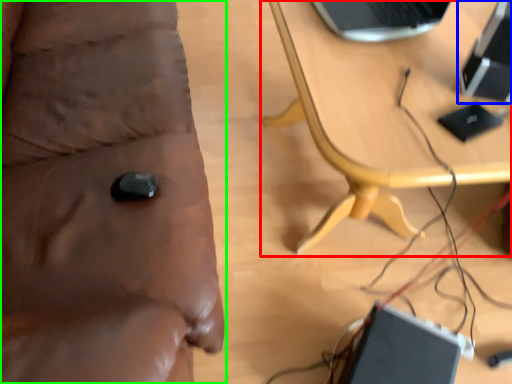
Question: Considering the real-world distances, which object is closest to table (highlighted by a red box)? computer (highlighted by a blue box) or furniture (highlighted by a green box).

Choices:
 (A) computer
 (B) furniture

Answer: (A)